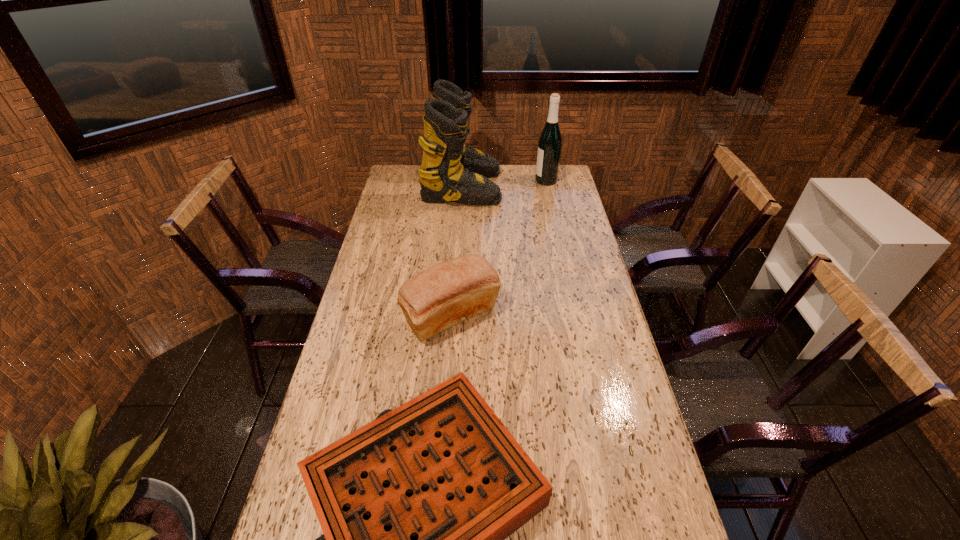
Locate an element on the screen. This screenshot has width=960, height=540. wine bottle situated at the far edge is located at coordinates (550, 141).

Where is `object at the right edge`? object at the right edge is located at coordinates pos(550,141).

Find the location of a particular element. This screenshot has height=540, width=960. object located at the far right corner is located at coordinates (550, 141).

What are the coordinates of `free space at the far edge of the desktop` in the screenshot? It's located at (516, 182).

Identify the location of free spot at the left edge of the desktop. Image resolution: width=960 pixels, height=540 pixels. (368, 264).

Find the location of a particular element. The image size is (960, 540). vacant space at the right edge is located at coordinates (583, 254).

Find the location of a particular element. The image size is (960, 540). vacant space at the far right corner of the desktop is located at coordinates (561, 170).

Find the location of a particular element. The height and width of the screenshot is (540, 960). vacant area that lies between the ski boots and the third tallest object is located at coordinates click(x=457, y=252).

The height and width of the screenshot is (540, 960). Identify the location of empty space that is in between the bread and the ski boots. (457, 252).

At what (x,y) coordinates should I click in order to perform the action: click on blank region between the second nearest object and the ski boots. Please return your answer as a coordinate pair (x, y). The width and height of the screenshot is (960, 540). Looking at the image, I should click on (457, 252).